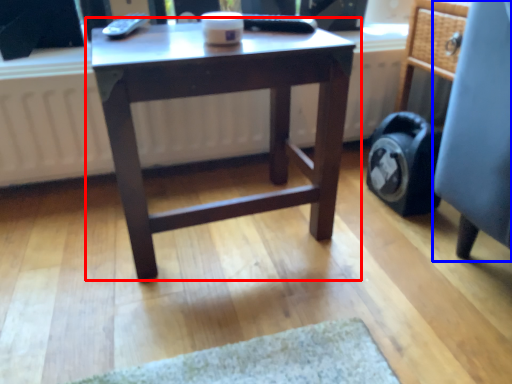
Question: Among these objects, which one is nearest to the camera, table (highlighted by a red box) or computer chair (highlighted by a blue box)?

Choices:
 (A) table
 (B) computer chair

Answer: (A)